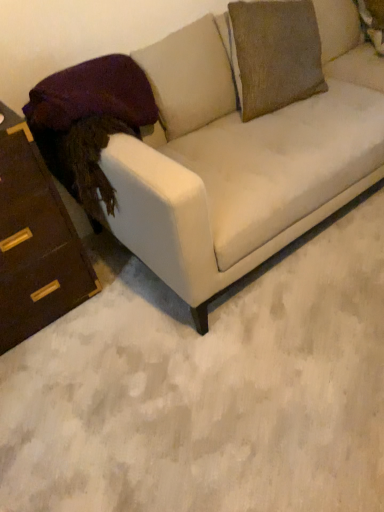
The image size is (384, 512). What do you see at coordinates (93, 95) in the screenshot? I see `velvet purple pillow at left` at bounding box center [93, 95].

This screenshot has width=384, height=512. I want to click on brown wood chest of drawers at left, so click(x=35, y=241).

Looking at this image, measure the distance between matte white couch at center and camera.

A distance of 1.15 meters exists between matte white couch at center and camera.

Identify the location of velvet purple pillow at left. (93, 95).

Can you confirm if brown wood chest of drawers at left is wider than matte white couch at center?

No, brown wood chest of drawers at left is not wider than matte white couch at center.

Is brown wood chest of drawers at left in contact with matte white couch at center?

No, brown wood chest of drawers at left is not with matte white couch at center.

What's the angular difference between brown wood chest of drawers at left and matte white couch at center's facing directions?

There is a 0.249-degree angle between the facing directions of brown wood chest of drawers at left and matte white couch at center.

Considering the positions of objects brown wood chest of drawers at left and matte white couch at center in the image provided, who is more to the right, brown wood chest of drawers at left or matte white couch at center?

matte white couch at center is more to the right.

Which of these two, matte white couch at center or velvet purple pillow at left, stands shorter?

Standing shorter between the two is velvet purple pillow at left.

Which is in front, matte white couch at center or velvet purple pillow at left?

matte white couch at center.

Where is `pillow above the matte white couch at center (from a real-world perspective)`? This screenshot has width=384, height=512. pillow above the matte white couch at center (from a real-world perspective) is located at coordinates (93, 95).

Is matte white couch at center in contact with brown wood chest of drawers at left?

matte white couch at center is not next to brown wood chest of drawers at left, and they're not touching.

From a real-world perspective, is matte white couch at center positioned above or below brown wood chest of drawers at left?

In terms of real-world spatial position, matte white couch at center is above brown wood chest of drawers at left.

Which is behind, point (189, 46) or point (17, 260)?

Point (189, 46)

Would you consider velvet purple pillow at left to be distant from matte white couch at center?

velvet purple pillow at left is actually quite close to matte white couch at center.

Can you confirm if velvet purple pillow at left is thinner than matte white couch at center?

Yes.

In the scene shown: Would you say matte white couch at center is part of velvet purple pillow at left's contents?

No.

In the scene shown: Is velvet purple pillow at left looking in the opposite direction of matte white couch at center?

Yes, velvet purple pillow at left's orientation is away from matte white couch at center.

From the image's perspective, which object appears higher, brown wood chest of drawers at left or velvet purple pillow at left?

velvet purple pillow at left appears higher in the image.

I want to click on the chest of drawers that is in front of the velvet purple pillow at left, so click(x=35, y=241).

Are brown wood chest of drawers at left and velvet purple pillow at left far apart?

That's not correct — brown wood chest of drawers at left is a little close to velvet purple pillow at left.

Does point (65, 253) lie in front of point (51, 89)?

That is False.

Which is behind, velvet purple pillow at left or brown wood chest of drawers at left?

velvet purple pillow at left.

From the image's perspective, is velvet purple pillow at left below brown wood chest of drawers at left?

No, from the image's perspective, velvet purple pillow at left is not beneath brown wood chest of drawers at left.

From a real-world perspective, relative to brown wood chest of drawers at left, is velvet purple pillow at left vertically above or below?

From a real-world perspective, velvet purple pillow at left is physically above brown wood chest of drawers at left.

Between velvet purple pillow at left and brown wood chest of drawers at left, which one has less height?

With less height is velvet purple pillow at left.

The height and width of the screenshot is (512, 384). What are the coordinates of `the chest of drawers that appears below the matte white couch at center (from the image's perspective)` in the screenshot? It's located at (35, 241).

The height and width of the screenshot is (512, 384). In order to click on pillow on the left of the matte white couch at center in this screenshot , I will do `click(93, 95)`.

Considering their positions, is velvet purple pillow at left positioned further to matte white couch at center than brown wood chest of drawers at left?

Based on the image, brown wood chest of drawers at left appears to be further to matte white couch at center.

Looking at the image, which one is located closer to velvet purple pillow at left, matte white couch at center or brown wood chest of drawers at left?

brown wood chest of drawers at left is closer to velvet purple pillow at left.

Which object lies nearer to the anchor point brown wood chest of drawers at left, matte white couch at center or velvet purple pillow at left?

Among the two, velvet purple pillow at left is located nearer to brown wood chest of drawers at left.

Looking at the image, which one is located closer to matte white couch at center, brown wood chest of drawers at left or velvet purple pillow at left?

The object closer to matte white couch at center is velvet purple pillow at left.

Estimate the real-world distances between objects in this image. Which object is further from velvet purple pillow at left, brown wood chest of drawers at left or matte white couch at center?

Among the two, matte white couch at center is located further to velvet purple pillow at left.

When comparing their distances from brown wood chest of drawers at left, does velvet purple pillow at left or matte white couch at center seem closer?

The object closer to brown wood chest of drawers at left is velvet purple pillow at left.

The width and height of the screenshot is (384, 512). Identify the location of pillow situated between brown wood chest of drawers at left and matte white couch at center from left to right. (93, 95).